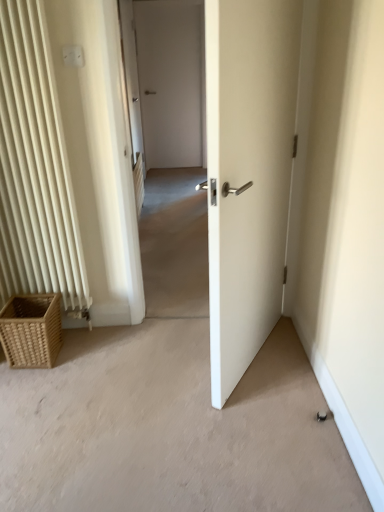
Question: Can you confirm if white plastic electric outlet at upper left is positioned to the left of woven brown picnic basket at lower left?

Choices:
 (A) yes
 (B) no

Answer: (B)

Question: Can you confirm if white plastic electric outlet at upper left is wider than woven brown picnic basket at lower left?

Choices:
 (A) yes
 (B) no

Answer: (B)

Question: From the image's perspective, would you say white plastic electric outlet at upper left is positioned over woven brown picnic basket at lower left?

Choices:
 (A) no
 (B) yes

Answer: (B)

Question: Would you say white plastic electric outlet at upper left is a long distance from woven brown picnic basket at lower left?

Choices:
 (A) yes
 (B) no

Answer: (A)

Question: Can you confirm if white plastic electric outlet at upper left is shorter than woven brown picnic basket at lower left?

Choices:
 (A) no
 (B) yes

Answer: (B)

Question: Does white plastic electric outlet at upper left come behind woven brown picnic basket at lower left?

Choices:
 (A) yes
 (B) no

Answer: (B)

Question: Can you confirm if woven brown picnic basket at lower left is thinner than white plastic electric outlet at upper left?

Choices:
 (A) no
 (B) yes

Answer: (A)

Question: Does woven brown picnic basket at lower left appear on the right side of white plastic electric outlet at upper left?

Choices:
 (A) no
 (B) yes

Answer: (A)

Question: From a real-world perspective, is woven brown picnic basket at lower left beneath white plastic electric outlet at upper left?

Choices:
 (A) no
 (B) yes

Answer: (B)

Question: Considering the relative sizes of woven brown picnic basket at lower left and white plastic electric outlet at upper left in the image provided, is woven brown picnic basket at lower left smaller than white plastic electric outlet at upper left?

Choices:
 (A) yes
 (B) no

Answer: (B)

Question: Is the position of woven brown picnic basket at lower left less distant than that of white plastic electric outlet at upper left?

Choices:
 (A) yes
 (B) no

Answer: (B)

Question: Are woven brown picnic basket at lower left and white plastic electric outlet at upper left far apart?

Choices:
 (A) yes
 (B) no

Answer: (A)

Question: Does point (41, 309) appear closer or farther from the camera than point (67, 50)?

Choices:
 (A) farther
 (B) closer

Answer: (A)